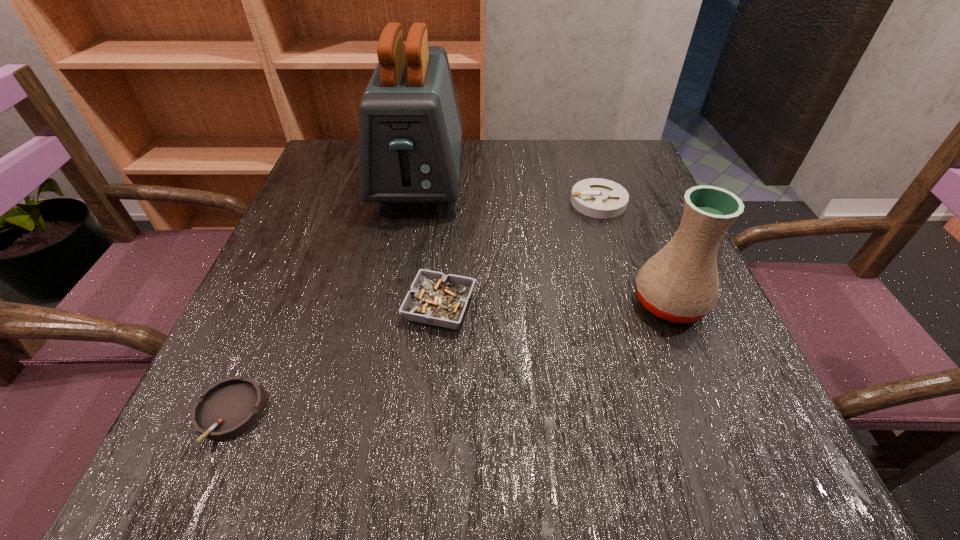
In order to click on the tallest object in this screenshot , I will do `click(410, 130)`.

Where is `pottery`? pottery is located at coordinates (680, 283).

I want to click on the rightmost ashtray, so click(599, 198).

You are a GUI agent. You are given a task and a screenshot of the screen. Output one action in this format:
    pyautogui.click(x=<x>, y=<y>)
    Task: Click on the second farthest ashtray
    Image resolution: width=960 pixels, height=540 pixels.
    Given the screenshot: What is the action you would take?
    pyautogui.click(x=437, y=299)

Identify the location of the shortest object. (229, 407).

Where is `the leftmost object`? the leftmost object is located at coordinates (229, 407).

The width and height of the screenshot is (960, 540). I want to click on vacant space situated on the front-facing side of the toaster, so click(x=392, y=329).

Where is `free point located on the front of the second tallest object`? free point located on the front of the second tallest object is located at coordinates (705, 388).

Identify the location of vacant point located on the back of the rightmost ashtray. (586, 161).

This screenshot has height=540, width=960. In order to click on blank space located on the left of the second ashtray from left to right in this screenshot , I will do `click(314, 307)`.